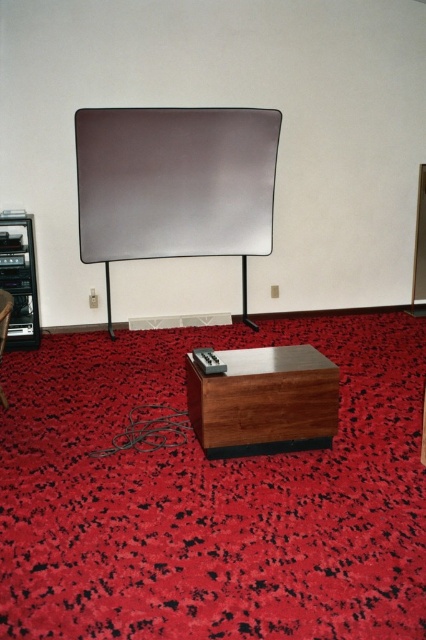
You are setting up a presentation and need to place a laptop on the surface that is taller. Which object should you choose between the matte silver screen at center and the wooden side table at lower center?

The matte silver screen at center has a greater height compared to the wooden side table at lower center, so you should place the laptop on the matte silver screen at center.

You are sitting on the matte wood chair at lower left and want to look at the matte silver screen at center. In which direction should you turn your head?

You should turn your head to the right to look at the matte silver screen at center since it is located to the right of the matte wood chair at lower left.